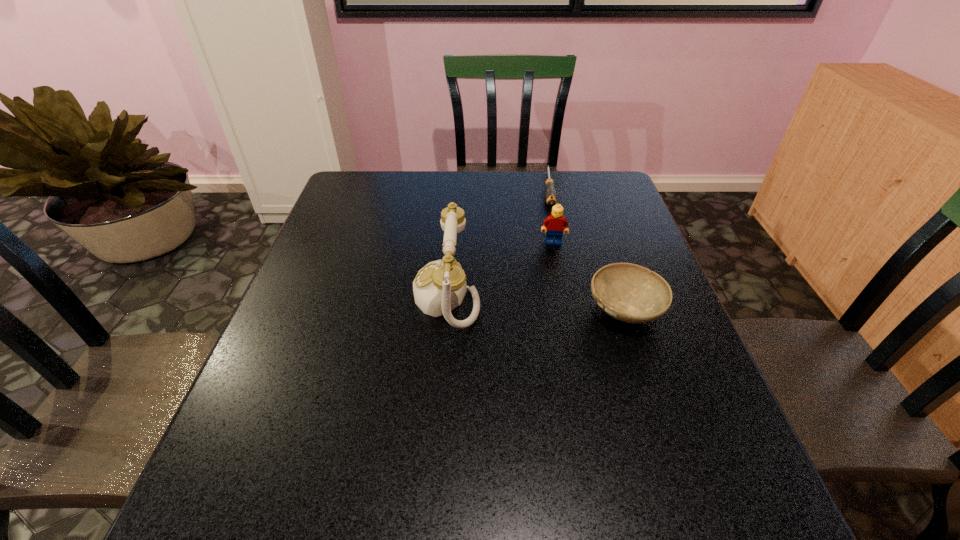
Identify the location of free region located on the dial of the tallest object. The width and height of the screenshot is (960, 540). (288, 295).

Find the location of a particular element. The height and width of the screenshot is (540, 960). vacant space situated on the left of the bowl is located at coordinates (455, 309).

Identify the location of vacant space located at the tip of the farthest object. This screenshot has height=540, width=960. (554, 230).

The image size is (960, 540). Find the location of `vacant area located at the tip of the farthest object`. vacant area located at the tip of the farthest object is located at coordinates (560, 292).

The width and height of the screenshot is (960, 540). In order to click on free space located at the tip of the farthest object in this screenshot , I will do `click(555, 247)`.

This screenshot has width=960, height=540. I want to click on vacant space located 0.100m on the front-facing side of the third nearest object, so click(x=553, y=269).

Where is `vacant space located 0.330m on the front-facing side of the third nearest object`? The height and width of the screenshot is (540, 960). vacant space located 0.330m on the front-facing side of the third nearest object is located at coordinates (555, 337).

Identify the location of free space located on the front-facing side of the third nearest object. (555, 344).

Where is `object present at the far edge`? The image size is (960, 540). object present at the far edge is located at coordinates (550, 195).

Locate an element on the screen. This screenshot has width=960, height=540. object that is at the right edge is located at coordinates (628, 292).